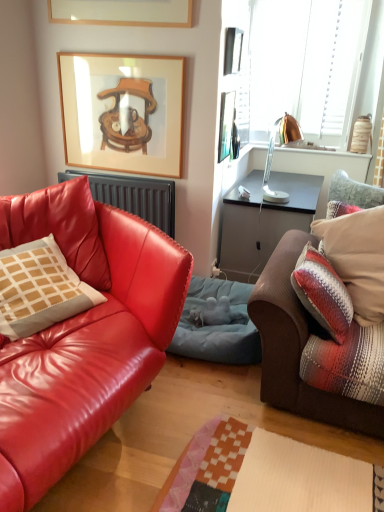
Question: Is copper metallic lamp at upper right directly adjacent to matte beige pillow at left, the 1th pillow positioned from the left?

Choices:
 (A) no
 (B) yes

Answer: (A)

Question: Is copper metallic lamp at upper right further to camera compared to matte beige pillow at left, which appears as the second pillow when viewed from the right?

Choices:
 (A) yes
 (B) no

Answer: (A)

Question: Is copper metallic lamp at upper right bigger than matte beige pillow at left, which appears as the second pillow when viewed from the right?

Choices:
 (A) no
 (B) yes

Answer: (A)

Question: Does copper metallic lamp at upper right come in front of matte beige pillow at left, which appears as the second pillow when viewed from the right?

Choices:
 (A) no
 (B) yes

Answer: (A)

Question: From the image's perspective, is copper metallic lamp at upper right under matte beige pillow at left, the 1th pillow positioned from the left?

Choices:
 (A) yes
 (B) no

Answer: (B)

Question: From a real-world perspective, relative to matte beige pillow at left, which appears as the second pillow when viewed from the right, is copper metallic lamp at upper right vertically above or below?

Choices:
 (A) below
 (B) above

Answer: (B)

Question: Considering the relative positions of copper metallic lamp at upper right and matte beige pillow at left, the 1th pillow positioned from the left, in the image provided, is copper metallic lamp at upper right to the left or to the right of matte beige pillow at left, the 1th pillow positioned from the left,?

Choices:
 (A) left
 (B) right

Answer: (B)

Question: Considering the positions of point (273, 139) and point (29, 324), is point (273, 139) closer or farther from the camera than point (29, 324)?

Choices:
 (A) farther
 (B) closer

Answer: (A)

Question: Is copper metallic lamp at upper right taller or shorter than matte beige pillow at left, the 1th pillow positioned from the left?

Choices:
 (A) short
 (B) tall

Answer: (B)

Question: Is point (241, 39) closer or farther from the camera than point (195, 276)?

Choices:
 (A) farther
 (B) closer

Answer: (A)

Question: Is metallic silver picture frame at upper center, acting as the 1th picture frame starting from the right, to the left or to the right of blue fabric pet bed at center in the image?

Choices:
 (A) right
 (B) left

Answer: (A)

Question: From the image's perspective, is metallic silver picture frame at upper center, acting as the 1th picture frame starting from the right, positioned above or below blue fabric pet bed at center?

Choices:
 (A) above
 (B) below

Answer: (A)

Question: Looking at the image, does metallic silver picture frame at upper center, marked as the third picture frame in a left-to-right arrangement, seem bigger or smaller compared to blue fabric pet bed at center?

Choices:
 (A) small
 (B) big

Answer: (A)

Question: Relative to plush brown couch at right, placed as the 2th studio couch when sorted from left to right, is matte leather couch at left, the first studio couch in the left-to-right sequence, in front or behind?

Choices:
 (A) behind
 (B) front

Answer: (B)

Question: Considering the positions of matte leather couch at left, the first studio couch in the left-to-right sequence, and plush brown couch at right, placed as the 2th studio couch when sorted from left to right, in the image, is matte leather couch at left, the first studio couch in the left-to-right sequence, bigger or smaller than plush brown couch at right, placed as the 2th studio couch when sorted from left to right,?

Choices:
 (A) big
 (B) small

Answer: (A)